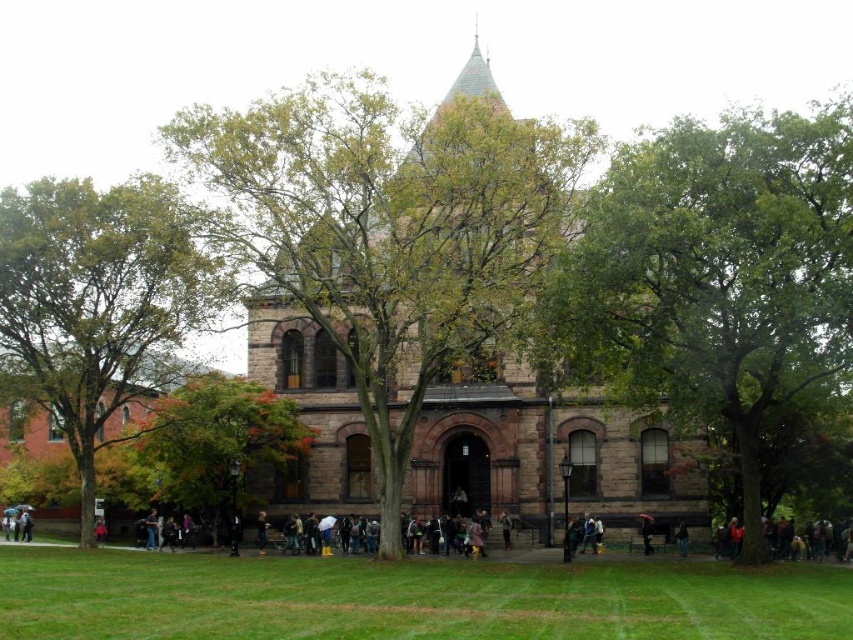
You are standing in front of the historic stone building and notice an object at point (646, 532). What is located at that coordinate?

The raincoat fabric umbrella at lower center is located at point (646, 532).

In the scene shown: You are standing on the lawn in front of the historic stone building. You see a green leafy tree at lower left and dark blue jeans at lower center. Which object is nearer to you?

The green leafy tree at lower left is closer to the viewer than dark blue jeans at lower center.